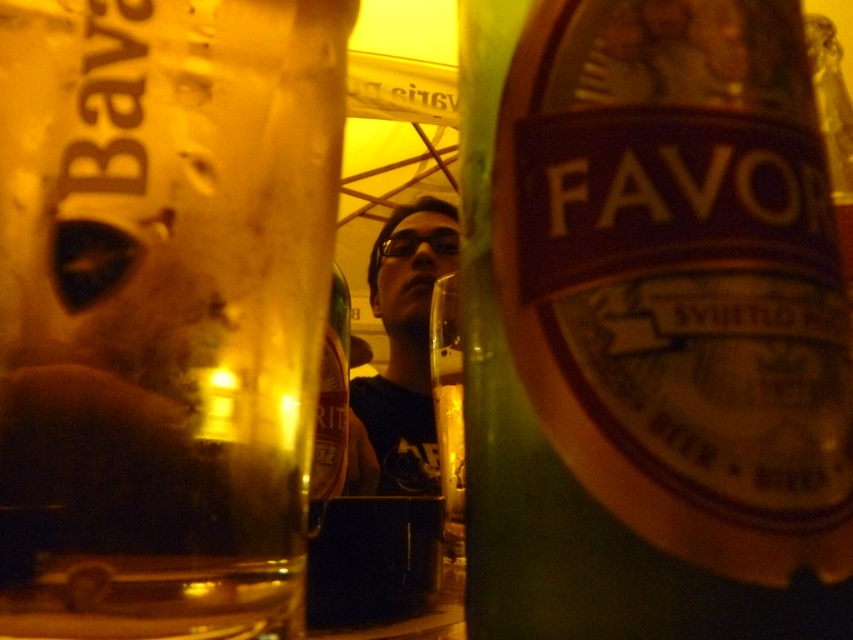
Question: Which object appears farthest from the camera in this image?

Choices:
 (A) translucent amber glass at left
 (B) green glass bottle at center right
 (C) matte black shirt at center
 (D) shiny gold bottle at center

Answer: (C)

Question: Can you confirm if translucent amber glass at left is wider than matte black shirt at center?

Choices:
 (A) yes
 (B) no

Answer: (B)

Question: Can you confirm if green glass bottle at center right is smaller than matte black shirt at center?

Choices:
 (A) no
 (B) yes

Answer: (B)

Question: Does translucent amber glass at left have a greater width compared to green glass bottle at center right?

Choices:
 (A) no
 (B) yes

Answer: (A)

Question: Which object appears farthest from the camera in this image?

Choices:
 (A) matte black shirt at center
 (B) green glass bottle at center right
 (C) shiny gold bottle at center

Answer: (A)

Question: Which object is positioned closest to the green glass bottle at center right?

Choices:
 (A) shiny gold bottle at center
 (B) matte black shirt at center

Answer: (A)